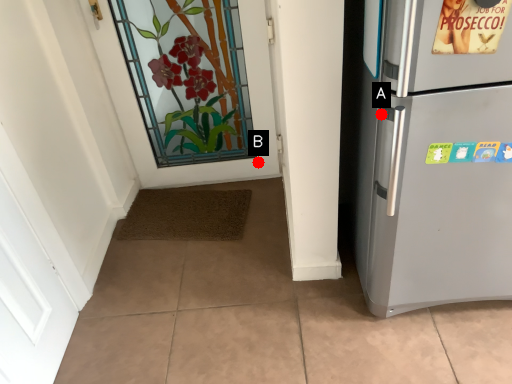
Question: Two points are circled on the image, labeled by A and B beside each circle. Which point appears farthest from the camera in this image?

Choices:
 (A) A is further
 (B) B is further

Answer: (B)